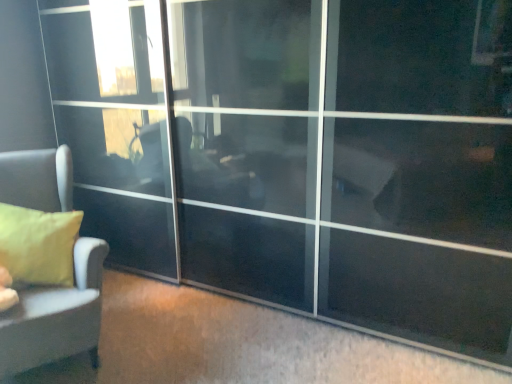
Question: Looking at the image, does transparent glass screen door at center seem bigger or smaller compared to matte yellow pillow at left?

Choices:
 (A) big
 (B) small

Answer: (A)

Question: Looking at their shapes, would you say transparent glass screen door at center is wider or thinner than matte yellow pillow at left?

Choices:
 (A) wide
 (B) thin

Answer: (A)

Question: Considering the real-world distances, which object is closest to the transparent glass screen door at center?

Choices:
 (A) matte gray sofa at left
 (B) matte yellow pillow at left

Answer: (B)

Question: Considering the real-world distances, which object is farthest from the matte yellow pillow at left?

Choices:
 (A) matte gray sofa at left
 (B) transparent glass screen door at center

Answer: (B)